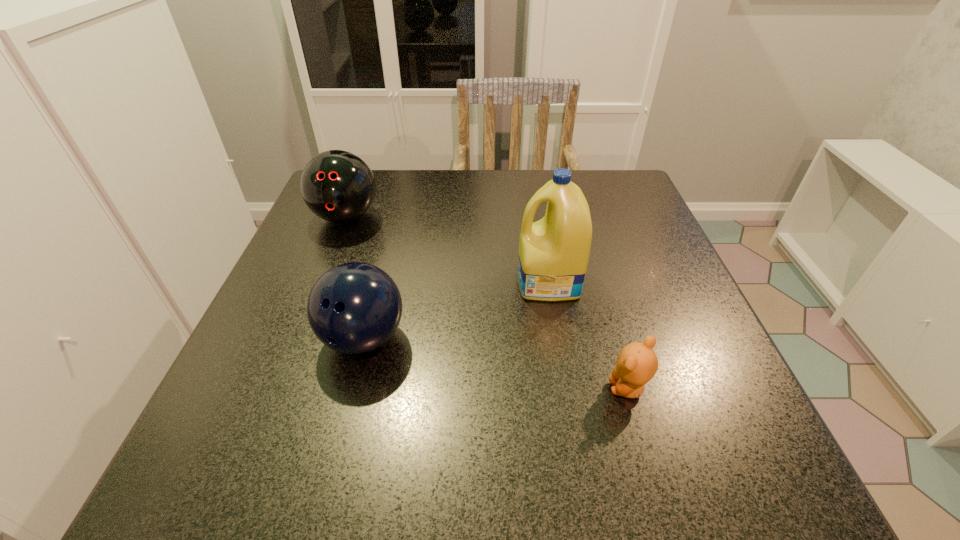
Locate an element on the screen. This screenshot has width=960, height=540. vacant space located 0.140m on the surface of the nearer bowling ball near the finger holes is located at coordinates (334, 457).

Where is `vacant space located on the face of the teddy bear`? The height and width of the screenshot is (540, 960). vacant space located on the face of the teddy bear is located at coordinates (361, 388).

This screenshot has width=960, height=540. In order to click on free space located 0.320m on the face of the teddy bear in this screenshot , I will do `click(405, 388)`.

At what (x,y) coordinates should I click in order to perform the action: click on vacant space positioned 0.350m on the face of the teddy bear. Please return your answer as a coordinate pair (x, y). This screenshot has height=540, width=960. Looking at the image, I should click on (386, 388).

The image size is (960, 540). Find the location of `object positioned at the far edge`. object positioned at the far edge is located at coordinates (338, 186).

Where is `object at the right edge`? The image size is (960, 540). object at the right edge is located at coordinates (636, 365).

The height and width of the screenshot is (540, 960). Find the location of `object that is at the far left corner`. object that is at the far left corner is located at coordinates (338, 186).

Identify the location of vacant region at the far edge of the desktop. (393, 184).

Identify the location of free space at the near edge of the desktop. The image size is (960, 540). (611, 444).

The image size is (960, 540). Identify the location of vacant space at the left edge. (225, 433).